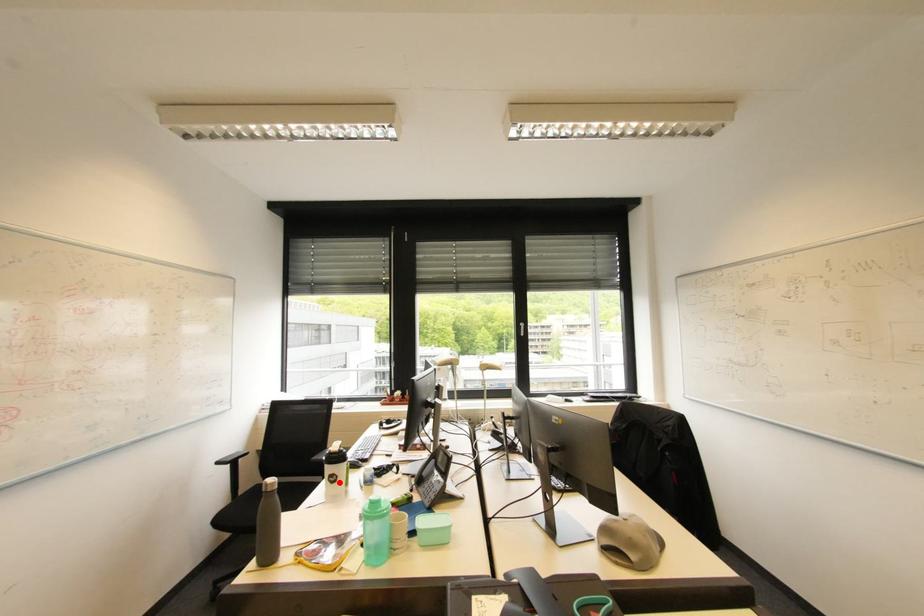
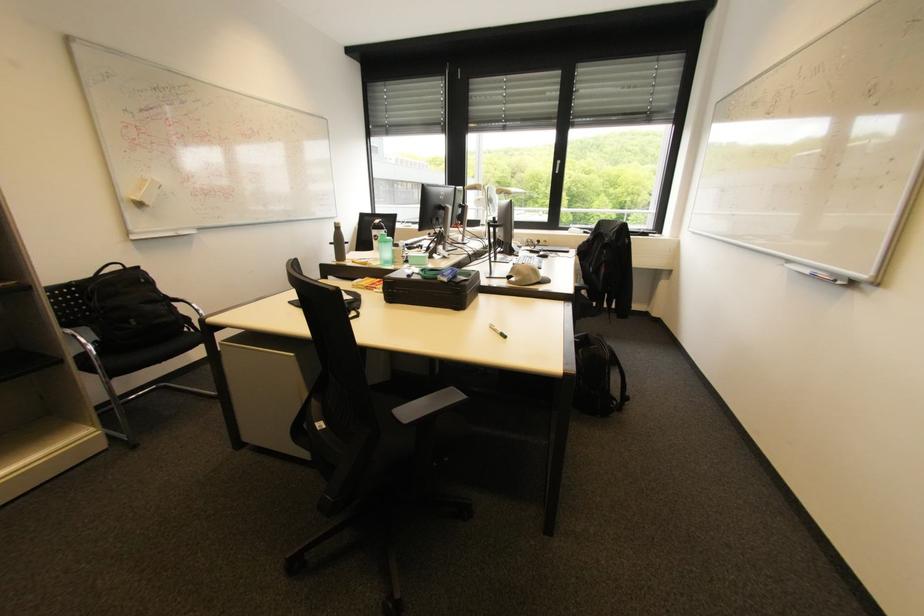
Where in the second image is the point corresponding to the highlighted location from the first image?

(382, 240)